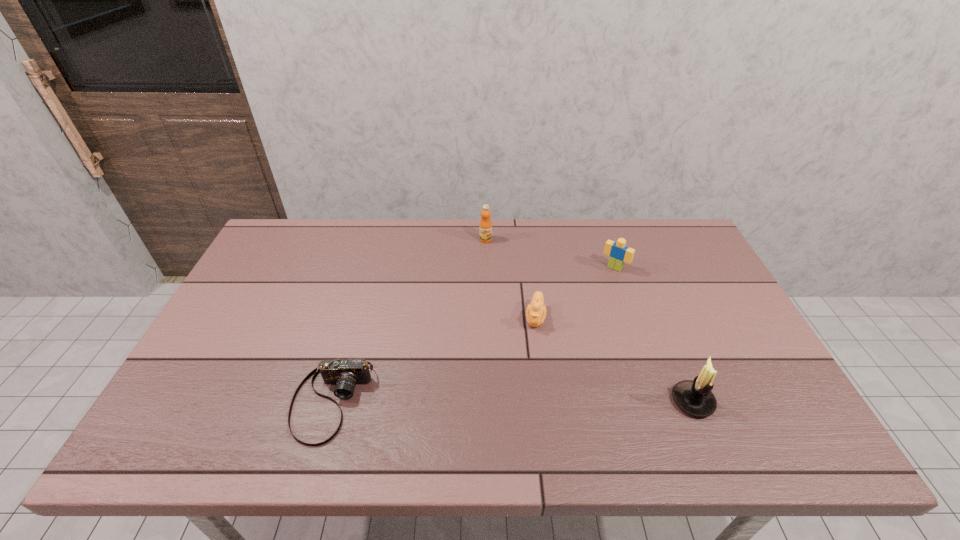
You are a GUI agent. You are given a task and a screenshot of the screen. Output one action in this format:
    pyautogui.click(x=<x>, y=<y>)
    Task: Click on the vacant space on the desktop that is between the camera and the candle holder and is positioned on the front label of the fourth object from right to left
    
    Given the screenshot: What is the action you would take?
    pyautogui.click(x=470, y=401)

Find the location of a particular element. The width and height of the screenshot is (960, 540). free space on the desktop that is between the leftmost object and the candle holder and is positioned on the face of the fourth tallest object is located at coordinates (521, 401).

The width and height of the screenshot is (960, 540). Identify the location of vacant space on the desktop that is between the camera and the candle holder and is positioned on the face of the fourth nearest object. (511, 401).